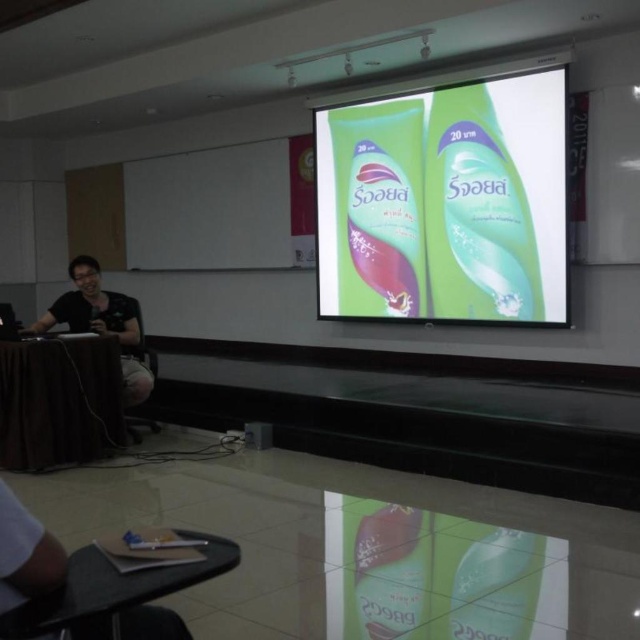
Question: Which point appears closest to the camera in this image?

Choices:
 (A) (88, 454)
 (B) (113, 326)

Answer: (A)

Question: Which of the following is the closest to the observer?

Choices:
 (A) black matte shirt at left
 (B) green plastic tubes at center

Answer: (A)

Question: Estimate the real-world distances between objects in this image. Which object is closer to the black fabric table at left?

Choices:
 (A) black matte shirt at left
 (B) matte brown notebook at lower left

Answer: (A)

Question: Does black fabric table at left have a greater width compared to matte brown notebook at lower left?

Choices:
 (A) no
 (B) yes

Answer: (B)

Question: Is green plastic tubes at center thinner than black matte shirt at left?

Choices:
 (A) yes
 (B) no

Answer: (B)

Question: Does matte brown notebook at lower left come behind black matte shirt at left?

Choices:
 (A) yes
 (B) no

Answer: (B)